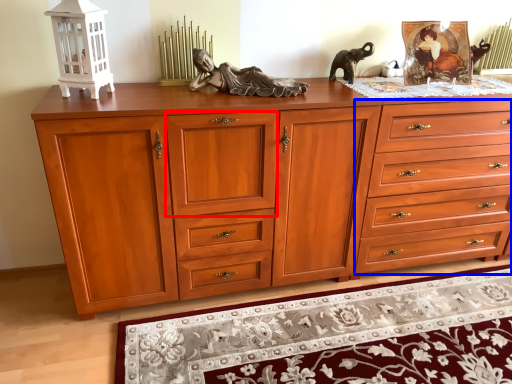
Question: Among these objects, which one is farthest to the camera, drawer (highlighted by a red box) or drawer (highlighted by a blue box)?

Choices:
 (A) drawer
 (B) drawer

Answer: (B)